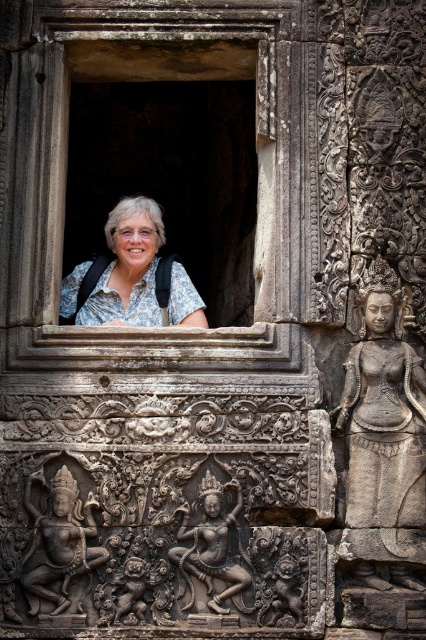
Question: Is gray stone statue at right below dark gray stone carving at center?

Choices:
 (A) no
 (B) yes

Answer: (A)

Question: Which point appears closest to the camera in this image?

Choices:
 (A) (120, 216)
 (B) (241, 305)
 (C) (247, 573)
 (D) (389, 300)

Answer: (C)

Question: Does stone window at center have a greater width compared to white floral shirt at center?

Choices:
 (A) yes
 (B) no

Answer: (A)

Question: Which point is closer to the camera?

Choices:
 (A) (74, 536)
 (B) (187, 529)
 (C) (94, 202)
 (D) (109, 237)

Answer: (B)

Question: Based on their relative distances, which object is nearer to the white floral shirt at center?

Choices:
 (A) dark gray stone carving at center
 (B) gray stone statue at right
 (C) stone window at center
 (D) dark gray stone sculpture at lower left

Answer: (C)

Question: Does white floral shirt at center have a smaller size compared to dark gray stone sculpture at lower left?

Choices:
 (A) yes
 (B) no

Answer: (B)